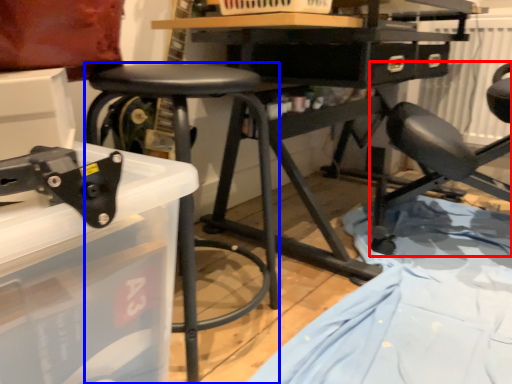
Question: Which point is closer to the camera, chair (highlighted by a red box) or stool (highlighted by a blue box)?

Choices:
 (A) chair
 (B) stool

Answer: (B)